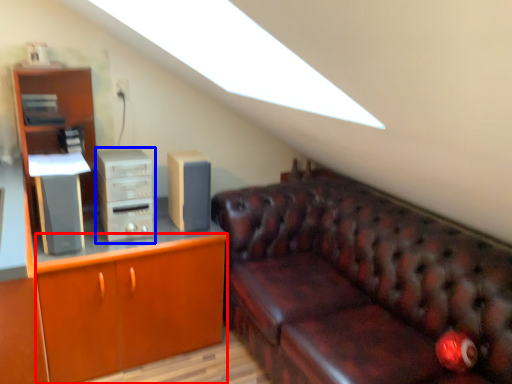
Question: Which object is further to the camera taking this photo, cabinetry (highlighted by a red box) or computer tower (highlighted by a blue box)?

Choices:
 (A) cabinetry
 (B) computer tower

Answer: (B)